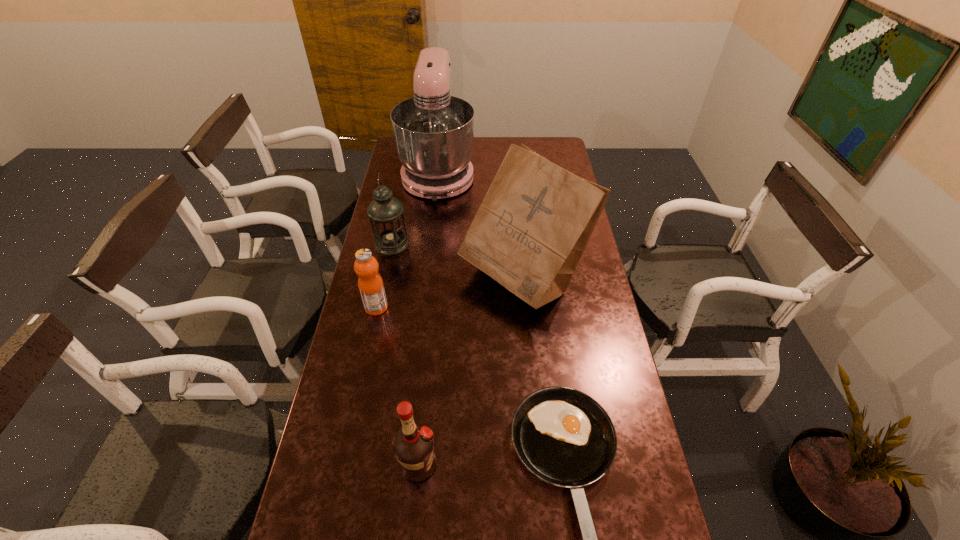
At what (x,y) coordinates should I click in order to perform the action: click on object that is at the far edge. Please return your answer as a coordinate pair (x, y). Looking at the image, I should click on (434, 132).

Locate an element on the screen. mixer situated at the left edge is located at coordinates (434, 132).

The height and width of the screenshot is (540, 960). What are the coordinates of `oil lamp present at the left edge` in the screenshot? It's located at (386, 213).

I want to click on fruit juice that is at the left edge, so click(x=371, y=287).

In order to click on object located at the right edge in this screenshot , I will do `click(533, 225)`.

At what (x,y) coordinates should I click in order to perform the action: click on object positioned at the far left corner. Please return your answer as a coordinate pair (x, y). Image resolution: width=960 pixels, height=540 pixels. Looking at the image, I should click on (434, 132).

Find the location of a particular element. The image size is (960, 540). free space at the left edge of the desktop is located at coordinates (352, 468).

The height and width of the screenshot is (540, 960). I want to click on free space at the right edge of the desktop, so click(586, 359).

This screenshot has width=960, height=540. I want to click on free spot between the fruit juice and the oil lamp, so click(x=384, y=275).

The height and width of the screenshot is (540, 960). I want to click on free space between the fifth tallest object and the liquor, so click(397, 386).